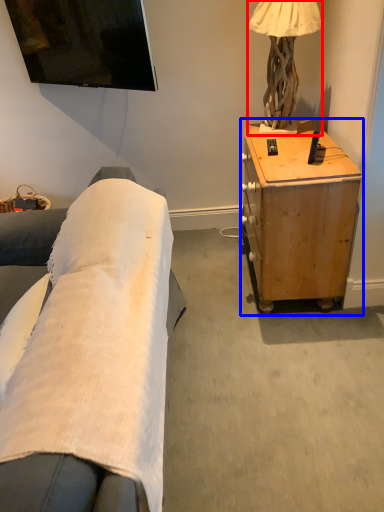
Question: Which point is closer to the camera, lamp (highlighted by a red box) or desk (highlighted by a blue box)?

Choices:
 (A) lamp
 (B) desk

Answer: (B)